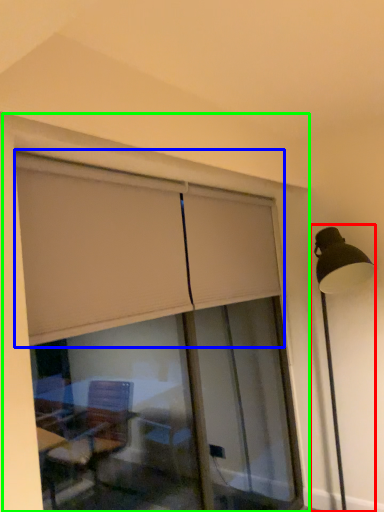
Question: Considering the real-world distances, which object is farthest from lamp post (highlighted by a red box)? curtain (highlighted by a blue box) or window frame (highlighted by a green box)?

Choices:
 (A) curtain
 (B) window frame

Answer: (A)